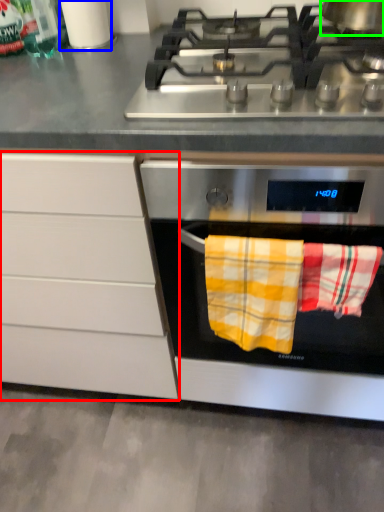
Question: Which object is the farthest from cabinetry (highlighted by a red box)? Choose among these: appliance (highlighted by a blue box) or kitchen appliance (highlighted by a green box).

Choices:
 (A) appliance
 (B) kitchen appliance

Answer: (B)